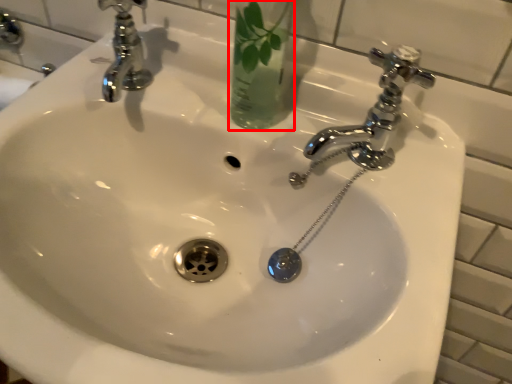
Question: From the image's perspective, what is the correct spatial positioning of glass vase (annotated by the red box) in reference to tap?

Choices:
 (A) below
 (B) above

Answer: (B)